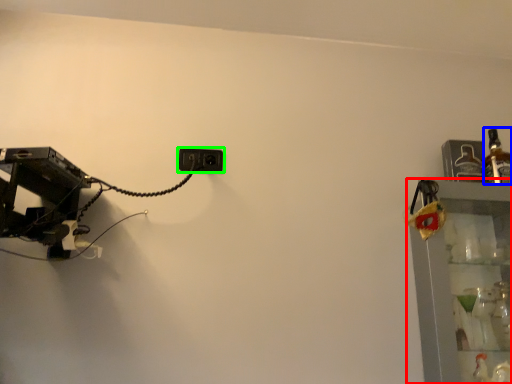
Question: Considering the real-world distances, which object is farthest from shelf (highlighted by a red box)? bottle (highlighted by a blue box) or power plugs and sockets (highlighted by a green box)?

Choices:
 (A) bottle
 (B) power plugs and sockets

Answer: (B)